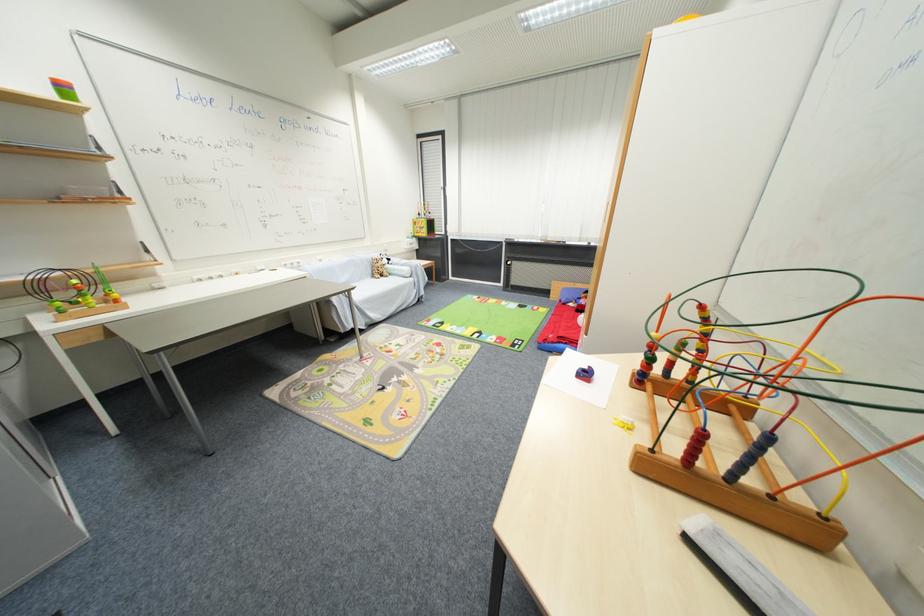
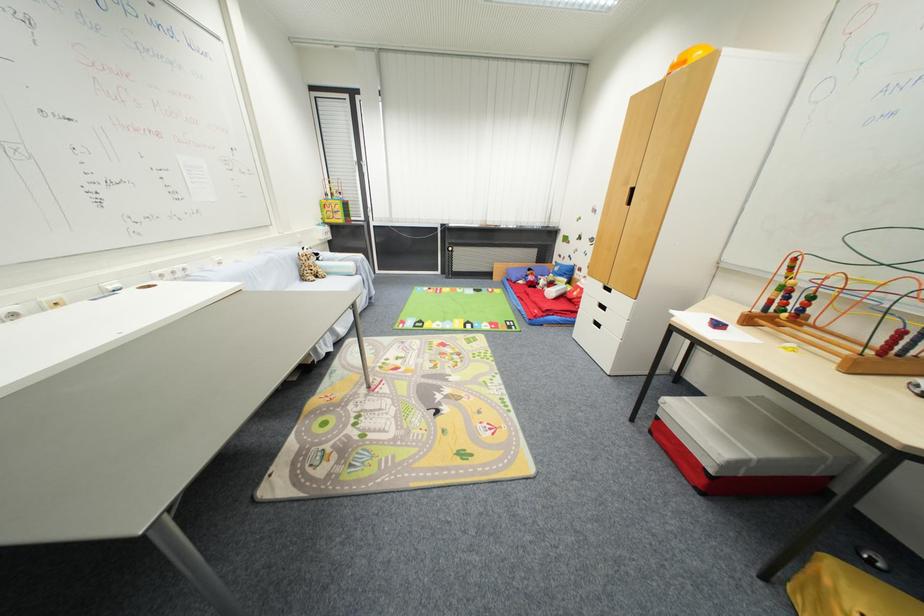
Where in the second image is the point corresponding to the point at 429,339 from the first image?

(423, 342)